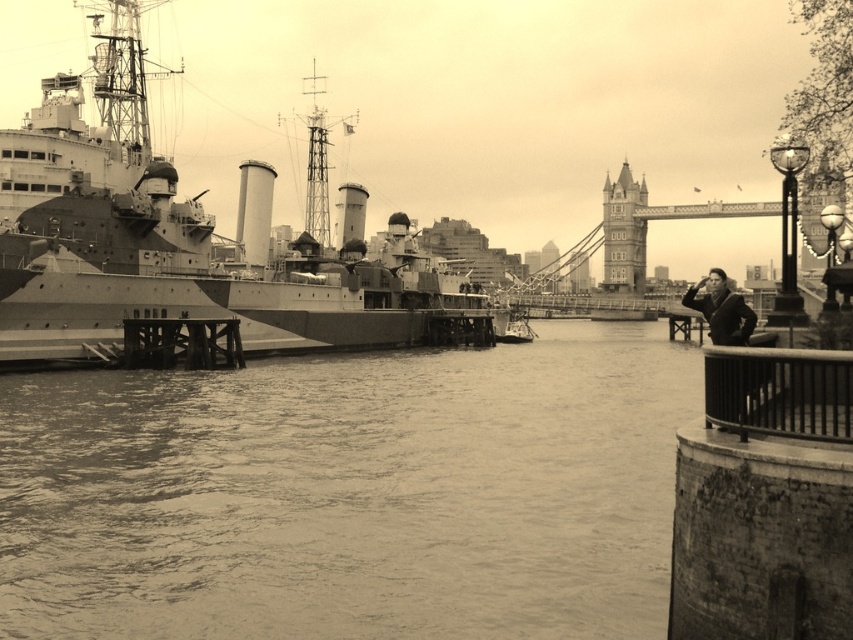
Question: Observing the image, what is the correct spatial positioning of rusty metal railing at lower right in reference to stone tower bridge at upper center?

Choices:
 (A) right
 (B) left

Answer: (B)

Question: Which object appears closest to the camera in this image?

Choices:
 (A) matte gray ship at left
 (B) smooth black coat at lower right

Answer: (B)

Question: Estimate the real-world distances between objects in this image. Which object is farther from the smooth black coat at lower right?

Choices:
 (A) rusty metal railing at lower right
 (B) stone tower bridge at upper center

Answer: (B)

Question: Is stone tower bridge at upper center above smooth black coat at lower right?

Choices:
 (A) yes
 (B) no

Answer: (A)

Question: Which object appears closest to the camera in this image?

Choices:
 (A) matte gray ship at left
 (B) rusty metal railing at lower right

Answer: (B)

Question: Is stone tower bridge at upper center closer to the viewer compared to smooth black coat at lower right?

Choices:
 (A) no
 (B) yes

Answer: (A)